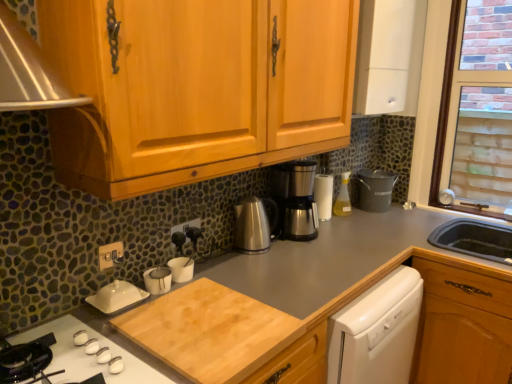
Question: Is translucent plastic spray bottle at center-right positioned with its back to white matte cabinet at upper right?

Choices:
 (A) no
 (B) yes

Answer: (A)

Question: Is translucent plastic spray bottle at center-right located outside white matte cabinet at upper right?

Choices:
 (A) no
 (B) yes

Answer: (B)

Question: Is translucent plastic spray bottle at center-right to the left of white matte cabinet at upper right from the viewer's perspective?

Choices:
 (A) no
 (B) yes

Answer: (B)

Question: Is translucent plastic spray bottle at center-right not close to white matte cabinet at upper right?

Choices:
 (A) no
 (B) yes

Answer: (A)

Question: From the image's perspective, would you say translucent plastic spray bottle at center-right is positioned over white matte cabinet at upper right?

Choices:
 (A) no
 (B) yes

Answer: (A)

Question: Is brick-patterned glass at upper right situated inside white matte cabinet at upper right or outside?

Choices:
 (A) outside
 (B) inside

Answer: (A)

Question: Would you say brick-patterned glass at upper right is to the left or to the right of white matte cabinet at upper right in the picture?

Choices:
 (A) left
 (B) right

Answer: (B)

Question: Is point [438, 182] closer or farther from the camera than point [367, 29]?

Choices:
 (A) closer
 (B) farther

Answer: (B)

Question: In the image, is brick-patterned glass at upper right positioned in front of or behind white matte cabinet at upper right?

Choices:
 (A) front
 (B) behind

Answer: (B)

Question: Is white matte cabinet at upper right bigger or smaller than brick-patterned glass at upper right?

Choices:
 (A) small
 (B) big

Answer: (B)

Question: Visually, is white matte cabinet at upper right positioned to the left or to the right of brick-patterned glass at upper right?

Choices:
 (A) left
 (B) right

Answer: (A)

Question: From a real-world perspective, is white matte cabinet at upper right positioned above or below brick-patterned glass at upper right?

Choices:
 (A) below
 (B) above

Answer: (B)

Question: Is white matte cabinet at upper right inside the boundaries of brick-patterned glass at upper right, or outside?

Choices:
 (A) inside
 (B) outside

Answer: (B)

Question: From the image's perspective, is white glossy gas stove at lower left positioned above or below gold metallic switch at lower left, the first electric outlet from the front?

Choices:
 (A) below
 (B) above

Answer: (A)

Question: Is white glossy gas stove at lower left to the left or to the right of gold metallic switch at lower left, the 2th electric outlet positioned from the back, in the image?

Choices:
 (A) left
 (B) right

Answer: (B)